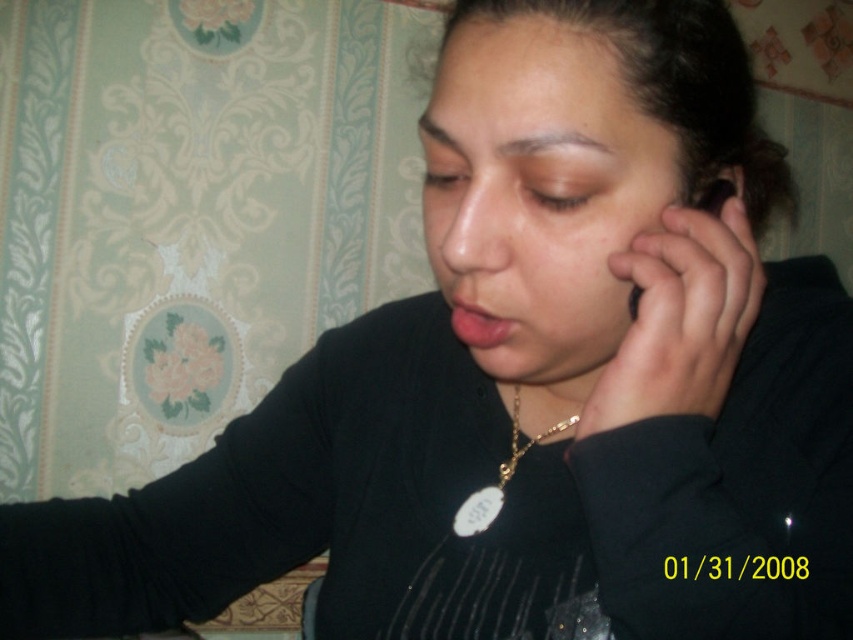
Can you confirm if matte skin nose at center is wider than gold chain at center?

Indeed, matte skin nose at center has a greater width compared to gold chain at center.

Between matte skin nose at center and gold chain at center, which one appears on the left side from the viewer's perspective?

Positioned to the left is matte skin nose at center.

Find the location of `matte skin nose at center`. matte skin nose at center is located at coordinates (468, 224).

Can you confirm if smooth skin at right is positioned to the right of gold chain at center?

Indeed, smooth skin at right is positioned on the right side of gold chain at center.

Locate an element on the screen. The height and width of the screenshot is (640, 853). smooth skin at right is located at coordinates (680, 317).

Is smooth skin at right bigger than matte skin nose at center?

No, smooth skin at right is not bigger than matte skin nose at center.

This screenshot has width=853, height=640. I want to click on smooth skin at right, so click(x=680, y=317).

Find the location of `smooth skin at right`. smooth skin at right is located at coordinates (680, 317).